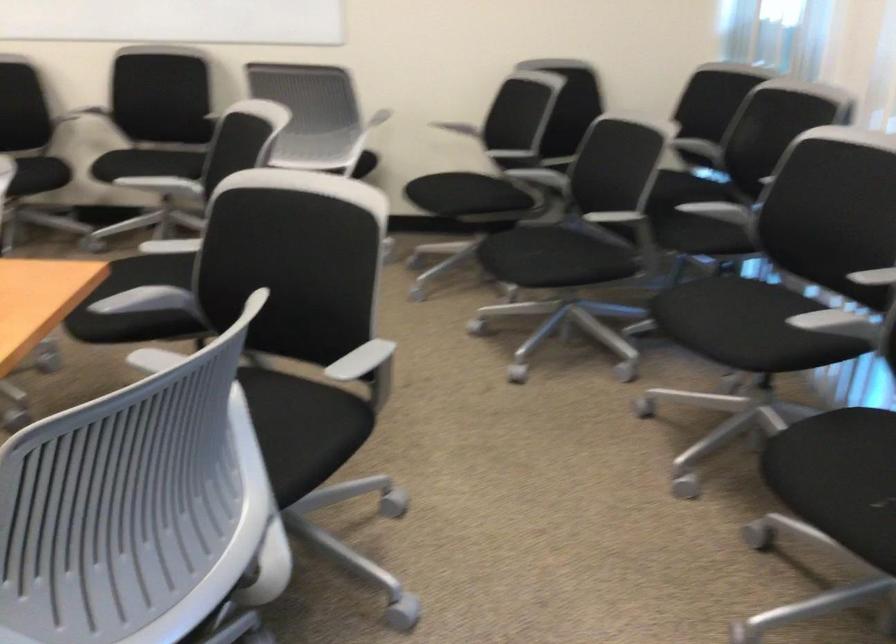
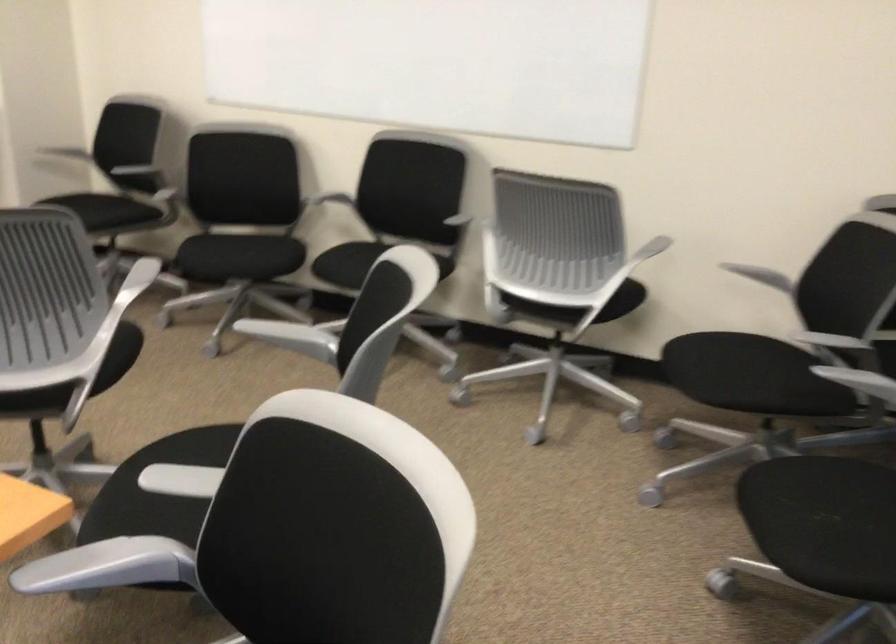
The point at (222, 106) is marked in the first image. Where is the corresponding point in the second image?

(469, 207)